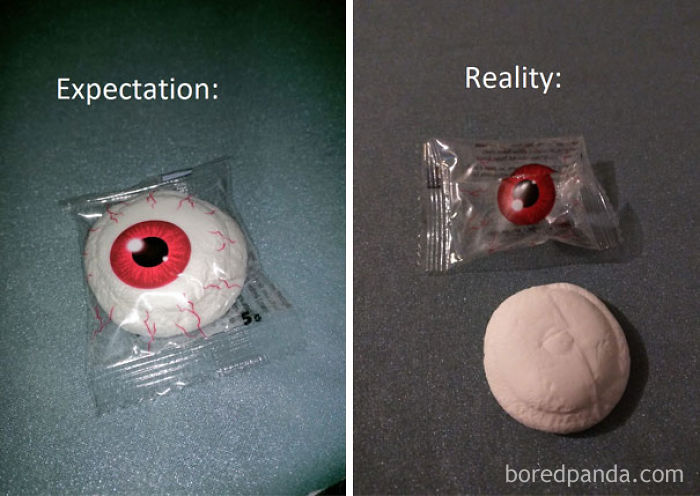
Where is `countertop`? countertop is located at coordinates (419, 323), (304, 367).